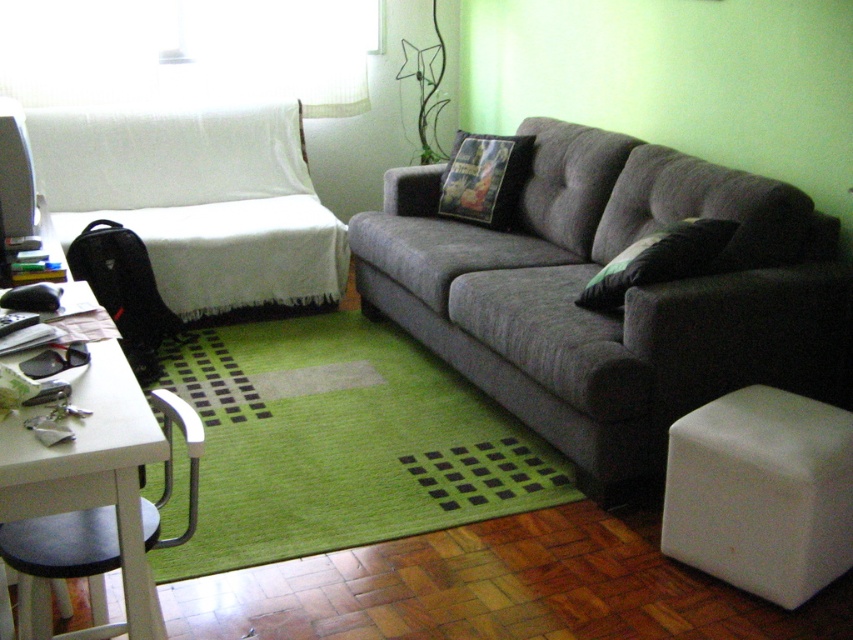
Question: Can you confirm if white fabric covered couch at left is thinner than black fabric pillow at center?

Choices:
 (A) yes
 (B) no

Answer: (B)

Question: Does gray fabric couch at center appear over white fabric covered couch at left?

Choices:
 (A) yes
 (B) no

Answer: (B)

Question: Among these points, which one is nearest to the camera?

Choices:
 (A) (x=169, y=544)
 (B) (x=759, y=260)
 (C) (x=801, y=397)
 (D) (x=102, y=122)

Answer: (A)

Question: Does white matte stool at lower right appear under black plastic chair at lower left?

Choices:
 (A) yes
 (B) no

Answer: (B)

Question: Which of the following is the farthest from the observer?

Choices:
 (A) (85, 564)
 (B) (616, 300)
 (C) (479, 156)
 (D) (735, 570)

Answer: (C)

Question: Which point is farther to the camera?

Choices:
 (A) (517, 296)
 (B) (18, 568)

Answer: (A)